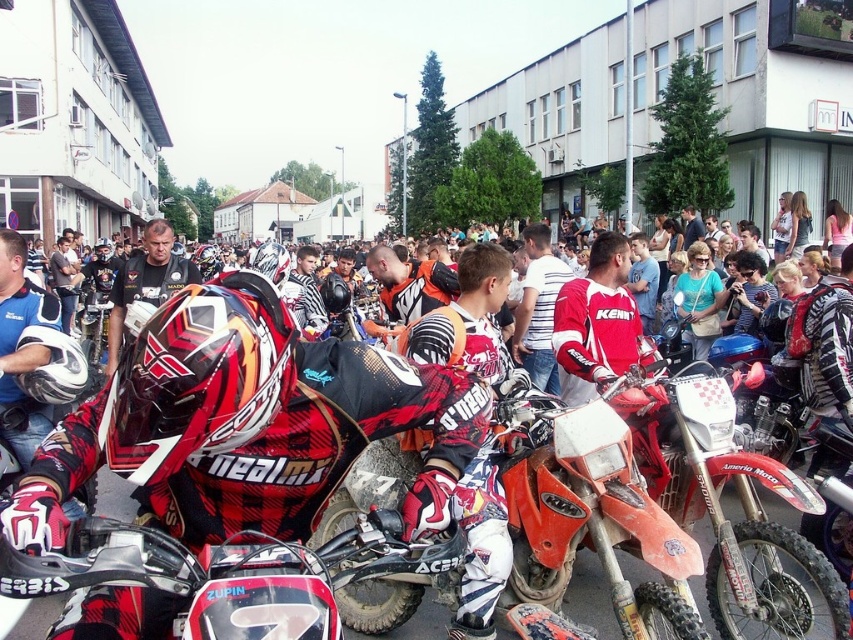
You are a photographer positioned at the back of the scene. You want to take a photo of both the red synthetic jacket at center and the matte black jacket at center. However, you notice that one is blocking the other. Which jacket is currently obscuring the other?

The red synthetic jacket at center is in front of matte black jacket at center, so the red synthetic jacket at center is obscuring the matte black jacket at center.

In the scene of the motocross event, there is a red synthetic jacket at center and a white striped shirt at center. From the perspective of someone standing in front of these two items, which one is positioned higher?

The red synthetic jacket at center is located above the white striped shirt at center, so it is positioned higher.

Consider the image. You are a photographer at the event and want to capture a photo focusing on the red and black motocross suit at center and the red synthetic jacket at center. Which one appears larger in the photo?

The red and black motocross suit at center appears larger in the photo because it is closer to the viewer than the red synthetic jacket at center.